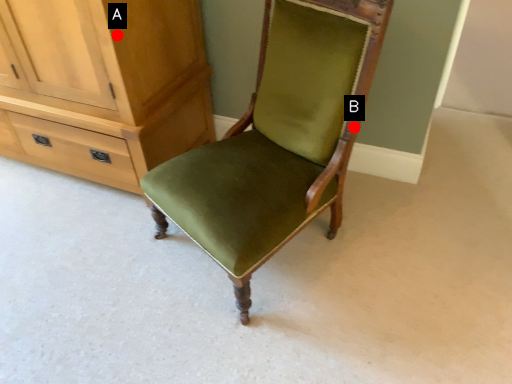
Question: Two points are circled on the image, labeled by A and B beside each circle. Among these points, which one is nearest to the camera?

Choices:
 (A) A is closer
 (B) B is closer

Answer: (A)